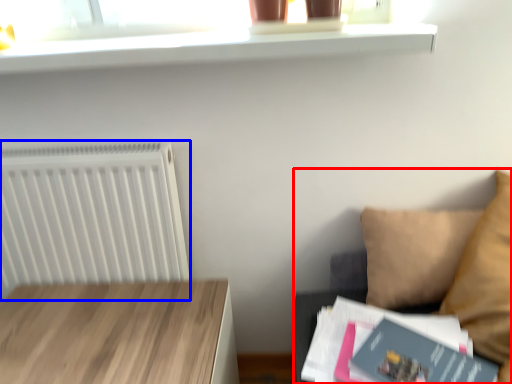
Question: Which of the following is the farthest to the observer, couch (highlighted by a red box) or radiator (highlighted by a blue box)?

Choices:
 (A) couch
 (B) radiator

Answer: (B)